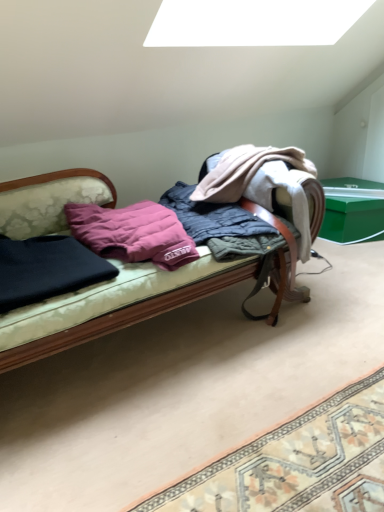
Question: Is dark blue fabric at left, arranged as the 1th clothing when viewed from the left, in front of purple down pillow at center?

Choices:
 (A) no
 (B) yes

Answer: (B)

Question: From a real-world perspective, is dark blue fabric at left, arranged as the 1th clothing when viewed from the left, located higher than purple down pillow at center?

Choices:
 (A) yes
 (B) no

Answer: (B)

Question: Can you confirm if dark blue fabric at left, arranged as the 1th clothing when viewed from the left, is smaller than purple down pillow at center?

Choices:
 (A) yes
 (B) no

Answer: (A)

Question: Is dark blue fabric at left, positioned as the second clothing in right-to-left order, taller than purple down pillow at center?

Choices:
 (A) no
 (B) yes

Answer: (A)

Question: Does dark blue fabric at left, positioned as the second clothing in right-to-left order, turn towards purple down pillow at center?

Choices:
 (A) no
 (B) yes

Answer: (A)

Question: Is green plastic box at right wider or thinner than velvet-like fabric couch at center?

Choices:
 (A) wide
 (B) thin

Answer: (B)

Question: Based on their positions, is green plastic box at right located to the left or right of velvet-like fabric couch at center?

Choices:
 (A) right
 (B) left

Answer: (A)

Question: In the image, is green plastic box at right positioned in front of or behind velvet-like fabric couch at center?

Choices:
 (A) front
 (B) behind

Answer: (B)

Question: From the image's perspective, is green plastic box at right positioned above or below velvet-like fabric couch at center?

Choices:
 (A) above
 (B) below

Answer: (A)

Question: From a real-world perspective, is purple down pillow at center positioned above or below dark blue fabric at left, arranged as the 1th clothing when viewed from the left?

Choices:
 (A) below
 (B) above

Answer: (B)

Question: In terms of size, does purple down pillow at center appear bigger or smaller than dark blue fabric at left, arranged as the 1th clothing when viewed from the left?

Choices:
 (A) small
 (B) big

Answer: (B)

Question: Is purple down pillow at center in front of or behind dark blue fabric at left, positioned as the second clothing in right-to-left order, in the image?

Choices:
 (A) front
 (B) behind

Answer: (B)

Question: Does point (72, 233) appear closer or farther from the camera than point (117, 268)?

Choices:
 (A) closer
 (B) farther

Answer: (B)

Question: Considering the positions of dark blue fabric at left, positioned as the second clothing in right-to-left order, and green plastic box at right in the image, is dark blue fabric at left, positioned as the second clothing in right-to-left order, bigger or smaller than green plastic box at right?

Choices:
 (A) big
 (B) small

Answer: (B)

Question: Is dark blue fabric at left, arranged as the 1th clothing when viewed from the left, inside the boundaries of green plastic box at right, or outside?

Choices:
 (A) inside
 (B) outside

Answer: (B)